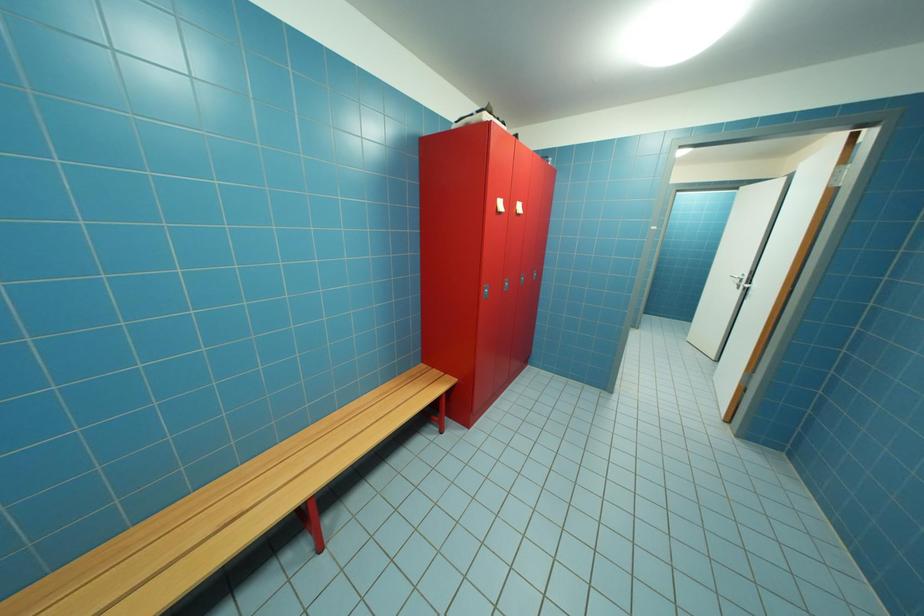
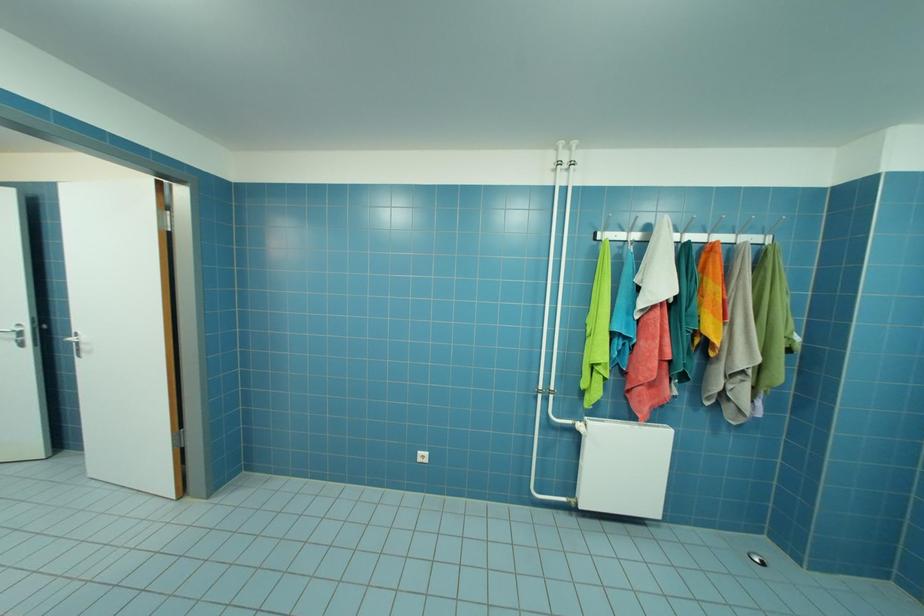
First-person continuous shooting, in which direction is the camera rotating?

The camera's rotation is toward right-down.